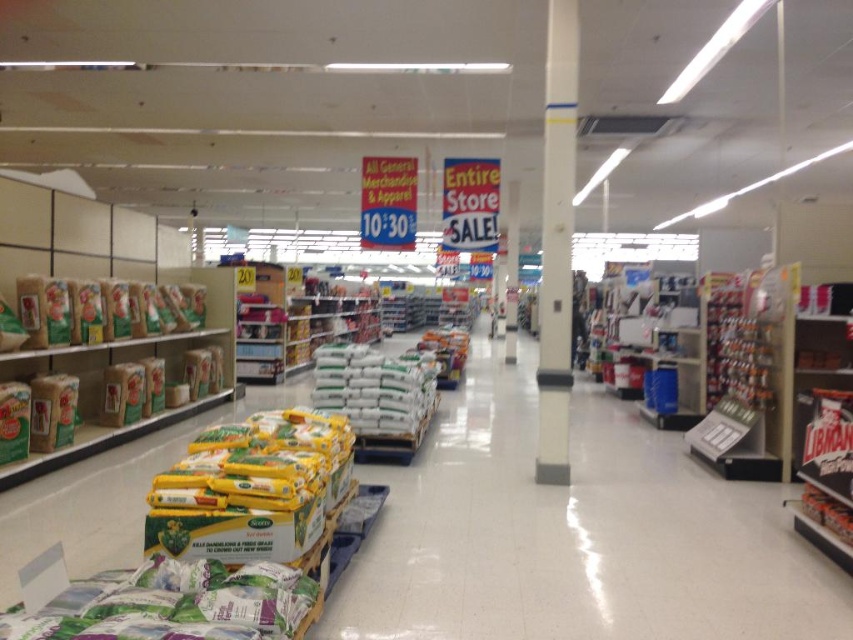
You are standing at the entrance of the store and see the white plastic bags at center. If you walk straight ahead, will you reach them before the end of the aisle?

The white plastic bags at center are located at point (573, 532) in the image. Since the aisle stretches into the distance, walking straight ahead would likely lead you past the bags before reaching the end of the aisle.

You are a customer in the store and need to place both the white plastic bags at center and the brown cardboard boxes at left into your shopping cart. Which item should you pick up first to ensure you can see the other item after placing it in the cart?

You should pick up the white plastic bags at center first because they are shorter than the brown cardboard boxes at left. Placing the shorter item in the cart first will allow you to still see the taller brown cardboard boxes at left when looking into the cart.